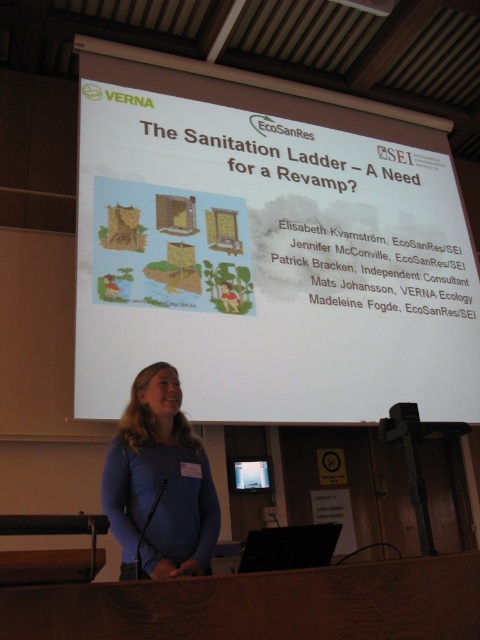
You are standing in the conference room and need to present a handout to the audience. The handout is 2 meters long. Can you lay it flat on the white matte projector screen at upper center without folding?

The white matte projector screen at upper center is 3.54 meters away from the viewer. However, the question is about the screen dimensions, not distance. The provided information does not specify the screen size, so it is impossible to determine if the handout will fit.

You are an attendee at the presentation and want to take a photo of the slide on the matte black screen at center. However, the presenter wearing the matte blue shirt at center is blocking your view. Can you determine if the presenter is closer to the screen than the screen is wide?

The matte blue shirt at center is bigger than the matte black screen at center. This suggests that the presenter is closer to the screen, making their shirt appear larger in comparison to the screen. Therefore, the presenter is likely blocking the view because they are closer than the screen width.

You are sitting in the audience of this presentation. You notice both the matte blue shirt at center and the matte black screen at center. Which object is nearer to you?

The matte blue shirt at center is closer to the viewer than the matte black screen at center.